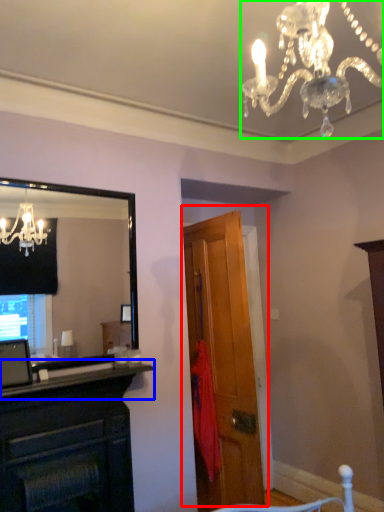
Question: Which object is the farthest from door (highlighted by a red box)? Choose among these: mantle (highlighted by a blue box) or lamp (highlighted by a green box).

Choices:
 (A) mantle
 (B) lamp

Answer: (B)